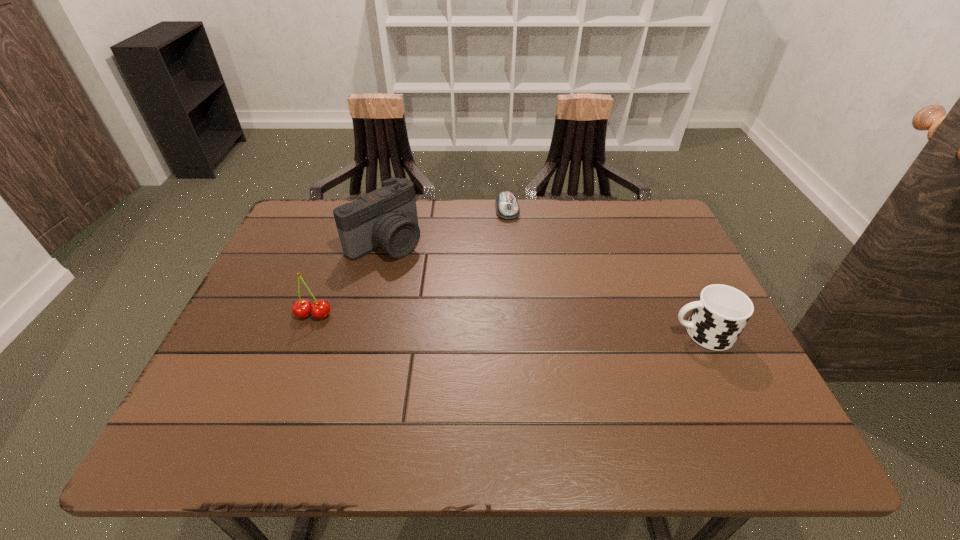
Where is `empty space that is in between the cherry and the rightmost object`? empty space that is in between the cherry and the rightmost object is located at coordinates coord(508,324).

Where is `unoccupied position between the shortest object and the cherry`? unoccupied position between the shortest object and the cherry is located at coordinates (411, 262).

The width and height of the screenshot is (960, 540). I want to click on unoccupied position between the cherry and the cup, so click(508, 324).

The height and width of the screenshot is (540, 960). I want to click on vacant space that's between the tallest object and the cup, so click(544, 287).

Locate an element on the screen. vacant space that's between the shortest object and the cherry is located at coordinates (411, 262).

Identify which object is the second closest to the computer mouse. Please provide its 2D coordinates. Your answer should be formatted as a tuple, i.e. [(x, y)], where the tuple contains the x and y coordinates of a point satisfying the conditions above.

[(721, 312)]

Identify the location of object identified as the second closest to the cherry. This screenshot has height=540, width=960. (507, 207).

At what (x,y) coordinates should I click in order to perform the action: click on vacant space that satisfies the following two spatial constraints: 1. with the stems of the cherry pointing upwards; 2. on the side of the cup with the handle. Please return your answer as a coordinate pair (x, y). Image resolution: width=960 pixels, height=540 pixels. Looking at the image, I should click on (307, 333).

The image size is (960, 540). I want to click on vacant area in the image that satisfies the following two spatial constraints: 1. with the stems of the cherry pointing upwards; 2. on the side of the rightmost object with the handle, so click(307, 333).

You are a GUI agent. You are given a task and a screenshot of the screen. Output one action in this format:
    pyautogui.click(x=<x>, y=<y>)
    Task: Click on the free spot that satisfies the following two spatial constraints: 1. on the front side of the shortest object; 2. on the side of the cup with the handle
    
    Given the screenshot: What is the action you would take?
    pyautogui.click(x=517, y=333)